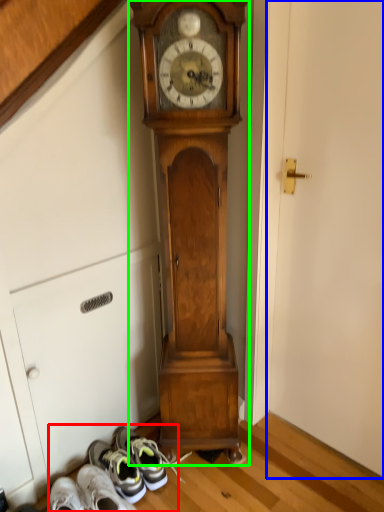
Question: Estimate the real-world distances between objects in this image. Which object is farther from shoe (highlighted by a red box), door (highlighted by a blue box) or wall clock (highlighted by a green box)?

Choices:
 (A) door
 (B) wall clock

Answer: (A)